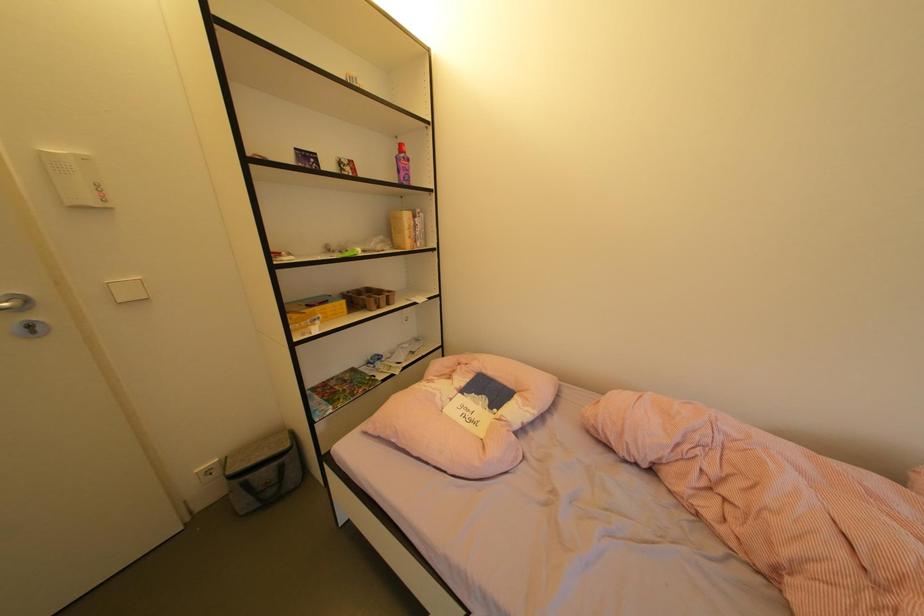
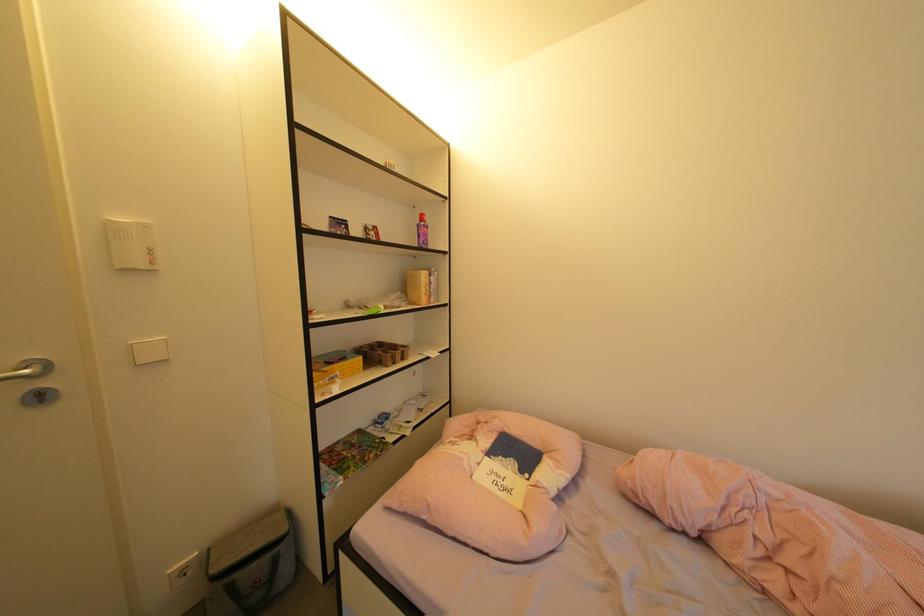
Question: Which direction would the cameraman need to move to produce the second image? Reply with the corresponding letter.

Choices:
 (A) Left
 (B) Right
 (C) Forward
 (D) Backward

Answer: (A)